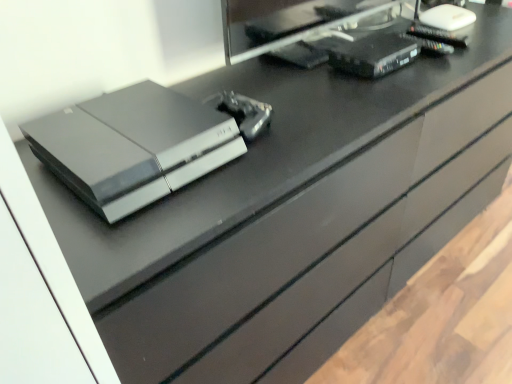
This screenshot has width=512, height=384. What are the coordinates of `free point to the left of black plastic router at upper right, the 2th equipment when ordered from bottom to top` in the screenshot? It's located at (306, 72).